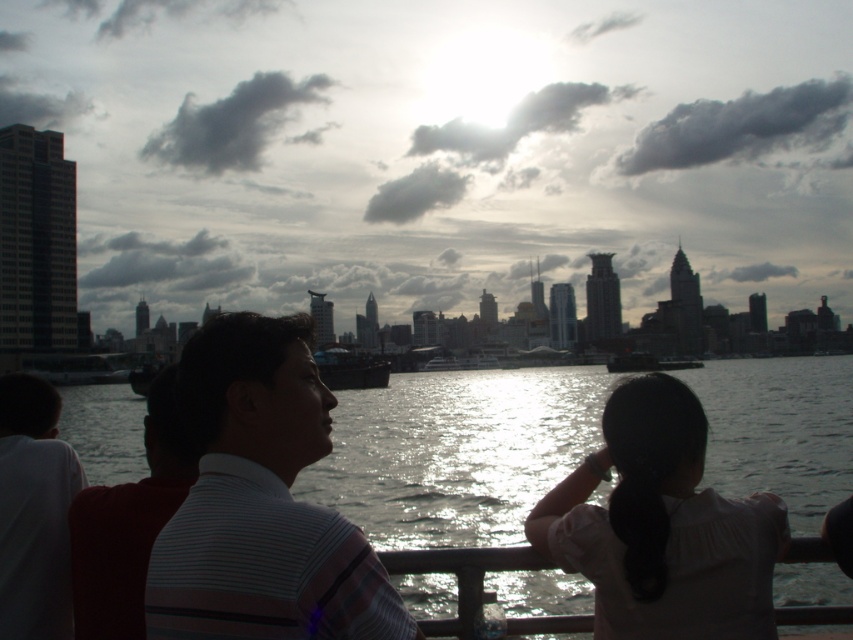
Consider the image. Can you confirm if glistening water at center is positioned below striped cotton shirt at center?

Correct, glistening water at center is located below striped cotton shirt at center.

Is point (96, 435) behind point (164, 611)?

Yes, it is behind point (164, 611).

Is point (364, 483) more distant than point (219, 561)?

Yes, point (364, 483) is farther from viewer.

The height and width of the screenshot is (640, 853). I want to click on glistening water at center, so click(456, 452).

Between striped cotton shirt at center and white striped shirt at center, which one appears on the right side from the viewer's perspective?

Positioned to the right is striped cotton shirt at center.

Who is shorter, striped cotton shirt at center or white striped shirt at center?

white striped shirt at center

The height and width of the screenshot is (640, 853). Describe the element at coordinates (260, 502) in the screenshot. I see `striped cotton shirt at center` at that location.

The image size is (853, 640). Identify the location of striped cotton shirt at center. (260, 502).

Which is behind, point (712, 628) or point (91, 579)?

Positioned behind is point (91, 579).

Can you confirm if white matte shirt at center is positioned above white striped shirt at center?

Incorrect, white matte shirt at center is not positioned above white striped shirt at center.

Is point (689, 440) positioned after point (96, 490)?

That is True.

Find the location of a particular element. This screenshot has height=640, width=853. white matte shirt at center is located at coordinates (662, 525).